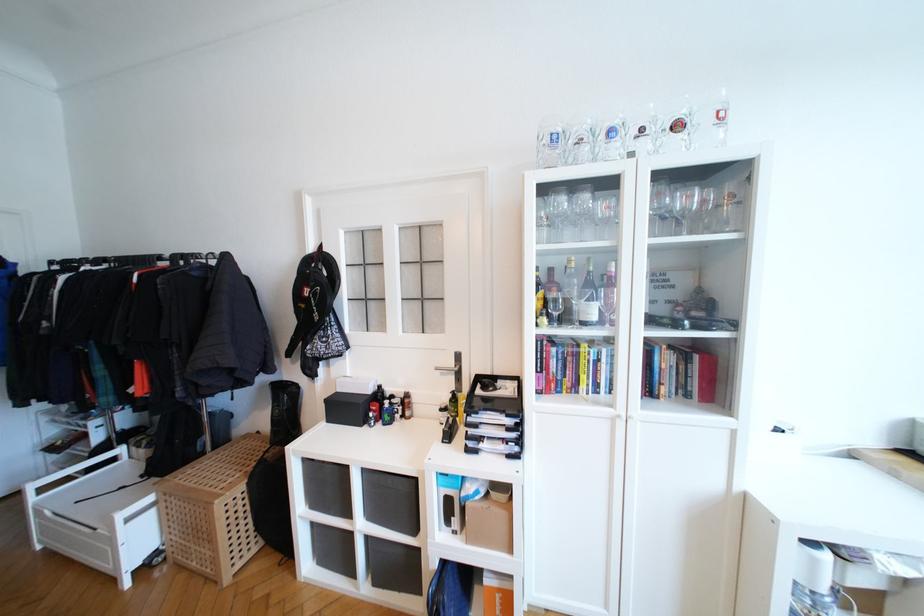
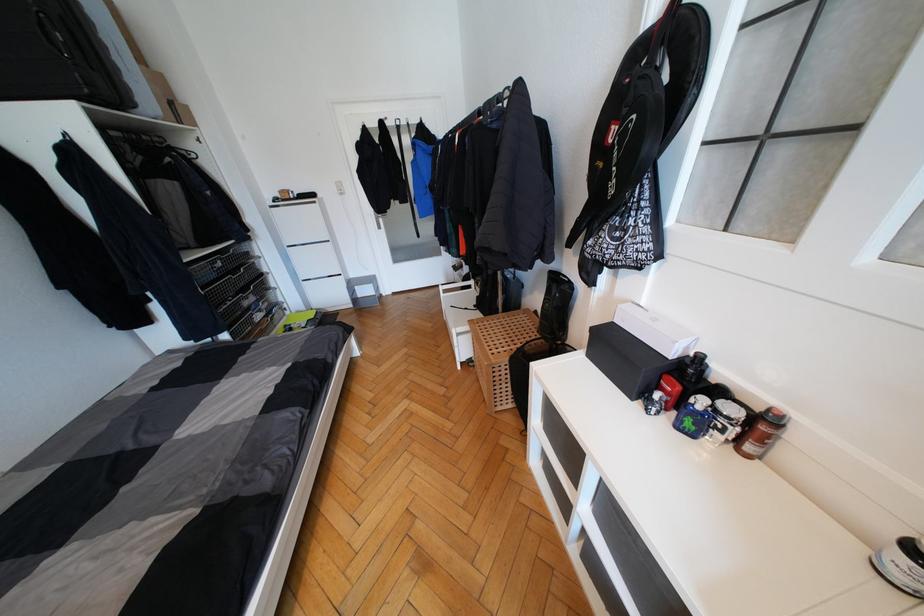
Locate, in the second image, the point that corresponds to (367,422) in the first image.

(640, 392)